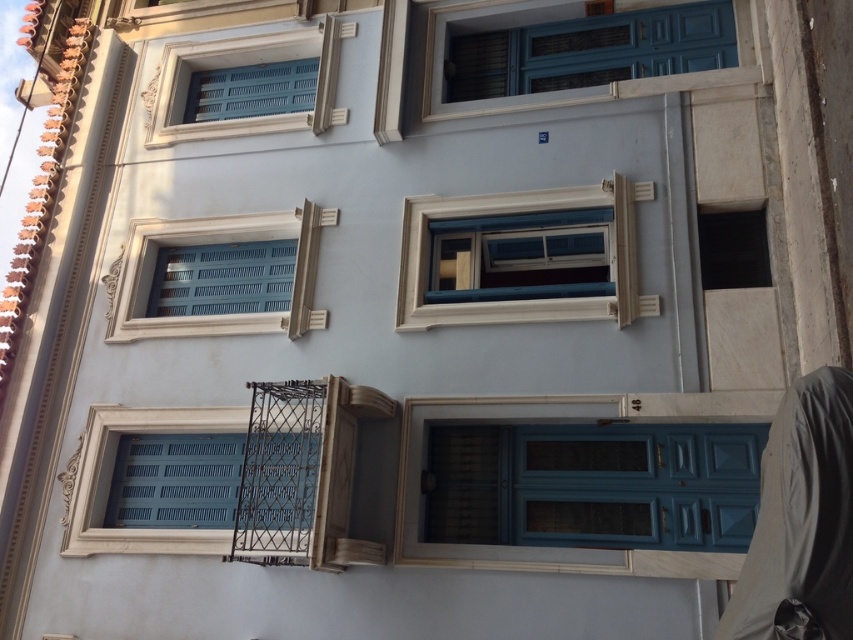
Question: Can you confirm if matte blue door at center is positioned above white painted wood window at upper left?

Choices:
 (A) no
 (B) yes

Answer: (A)

Question: From the image, what is the correct spatial relationship of matte blue shutter at center in relation to white painted wood window at upper left?

Choices:
 (A) left
 (B) right

Answer: (A)

Question: Among these points, which one is farthest from the camera?

Choices:
 (A) (624, 397)
 (B) (125, 259)

Answer: (B)

Question: Does matte blue door at center have a greater width compared to white painted wood window at upper left?

Choices:
 (A) yes
 (B) no

Answer: (A)

Question: Which object is closer to the camera taking this photo?

Choices:
 (A) white painted wood window at upper left
 (B) matte blue door at center
 (C) matte blue door at upper center

Answer: (B)

Question: Which of the following is the farthest from the observer?

Choices:
 (A) white painted wood window at upper left
 (B) matte wood window at center
 (C) matte blue door at center
 (D) matte blue shutters at upper left

Answer: (D)